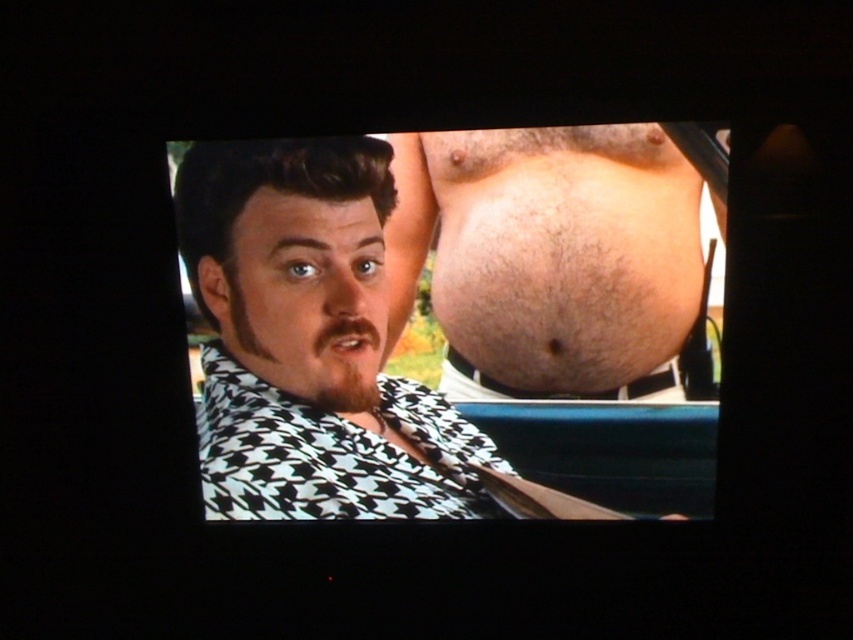
You are a costume designer preparing for a play. You need to ensure that the black houndstooth shirt at center and the hairy skin belly at center can be accommodated in the wardrobe space. Given that the wardrobe has a width limit of 40 cm, can both items fit side by side?

The black houndstooth shirt at center is wider than the hairy skin belly at center. However, since the wardrobe has a width limit of 40 cm, we need to know the exact widths of both items to determine if they can fit together. Unfortunately, the provided information does not specify their individual widths, only that the shirt is wider than the belly. Without knowing the exact measurements, it is impossible to confirm if they will fit within the 40 cm limit.

Based on the coordinates provided, which object is located at point [310,342] in the image?

The point [310,342] indicates the black houndstooth shirt at center.